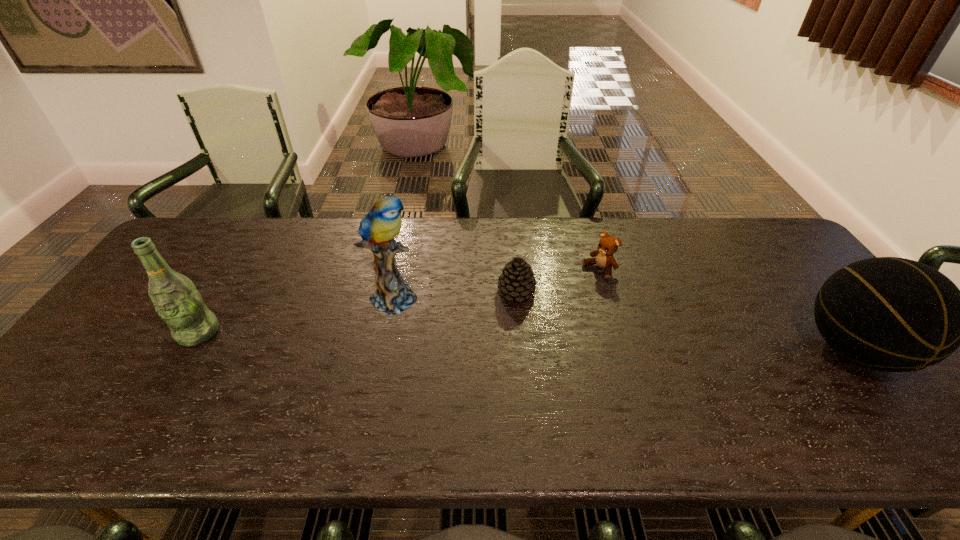
Identify the location of vacant spot on the desktop that is between the beer bottle and the rightmost object and is positioned on the face of the tallest object. The image size is (960, 540). (479, 340).

In order to click on free space on the desktop that is between the beer bottle and the rightmost object and is positioned on the front-facing side of the teddy bear in this screenshot , I will do `click(501, 341)`.

At what (x,y) coordinates should I click in order to perform the action: click on free space on the desktop that is between the leftmost object and the basketball and is positioned at the narrow end of the pinecone. Please return your answer as a coordinate pair (x, y). Image resolution: width=960 pixels, height=540 pixels. Looking at the image, I should click on (482, 340).